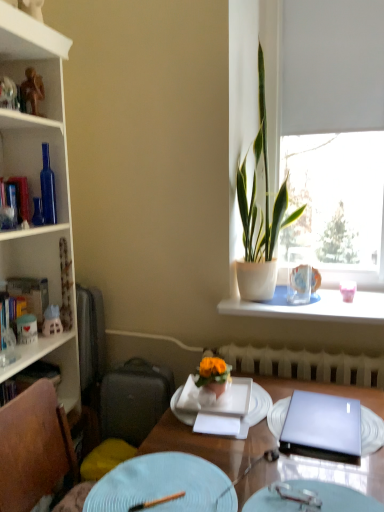
The image size is (384, 512). What are the coordinates of `vacant space positioned to the left of metallic silver fork at center, marked as the 2th tableware in a top-to-bottom arrangement` in the screenshot? It's located at (236, 489).